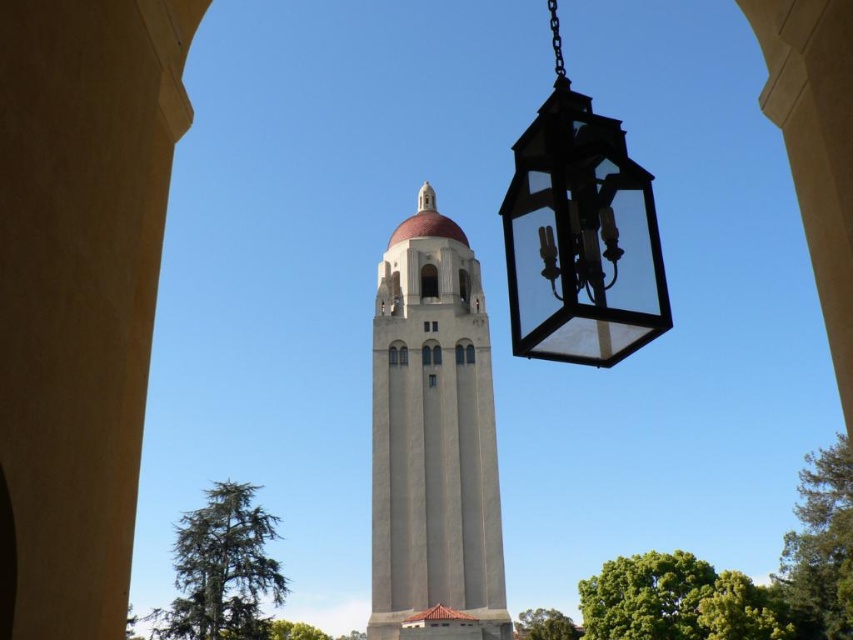
You are standing in front of the arched opening of the smooth concrete tower at center. If you want to walk towards the tower, which direction should you move relative to the archway?

Since the smooth concrete tower at center is located at point (433, 440), you should move towards the center of the archway to approach the tower.

You are standing in front of the tower and want to hang a new decorative item. If you place it above the smooth concrete tower at center, will it be above or below the black glass lantern at upper right?

The smooth concrete tower at center is below the black glass lantern at upper right, so placing an item above the tower would position it below the existing black glass lantern at upper right.

You are an architect designing a new lighting system for the smooth concrete tower at center. You need to ensure that the black glass lantern at upper right does not block the view of the tower. Given their heights, is the lantern positioned in a way that it might obstruct the tower from being seen clearly?

The smooth concrete tower at center is taller than the black glass lantern at upper right, so the lantern is positioned lower and less likely to obstruct the view of the tower.